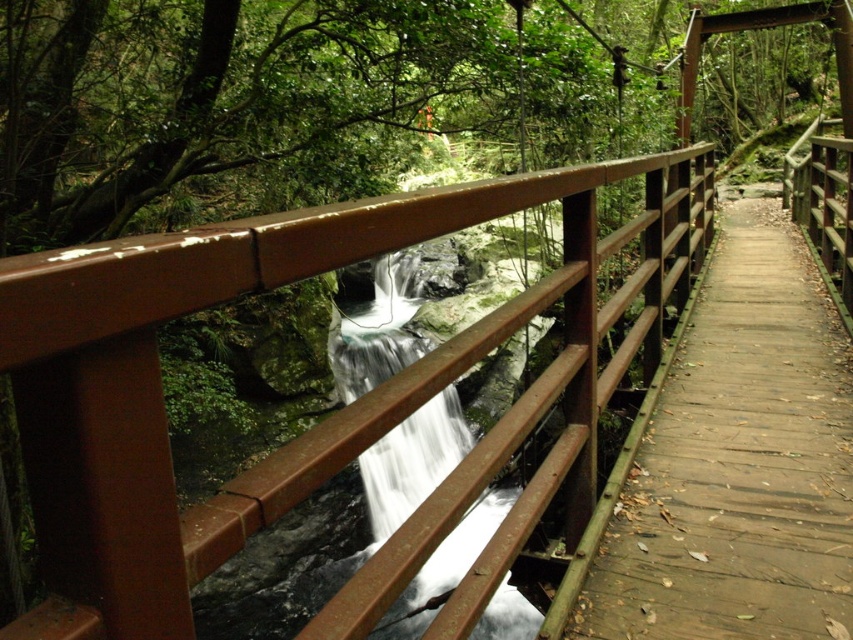
Is point (196, 552) positioned in front of point (831, 349)?

Yes, it is in front of point (831, 349).

Is brown wooden rail at center further to camera compared to wooden planks at center?

Yes, brown wooden rail at center is further from the viewer.

Does point (105, 547) come behind point (788, 481)?

No, it is in front of (788, 481).

Locate an element on the screen. This screenshot has height=640, width=853. brown wooden rail at center is located at coordinates (323, 419).

Consider the image. Does brown wooden rail at center have a greater height compared to white smooth water at center?

No, brown wooden rail at center is not taller than white smooth water at center.

Is brown wooden rail at center behind white smooth water at center?

Yes, brown wooden rail at center is further from the viewer.

Where is `brown wooden rail at center`? brown wooden rail at center is located at coordinates (323, 419).

Which is above, wooden planks at center or white smooth water at center?

wooden planks at center

Between wooden planks at center and white smooth water at center, which one has less height?

With less height is wooden planks at center.

You are a GUI agent. You are given a task and a screenshot of the screen. Output one action in this format:
    pyautogui.click(x=<x>, y=<y>)
    Task: Click on the wooden planks at center
    The height and width of the screenshot is (640, 853).
    Given the screenshot: What is the action you would take?
    pyautogui.click(x=737, y=460)